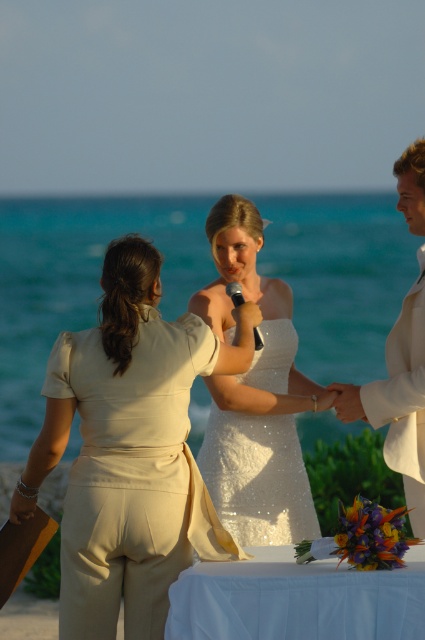
Question: Which object is closer to the camera taking this photo?

Choices:
 (A) white sequined dress at center
 (B) beige satin jumpsuit at center
 (C) white cloth table at center

Answer: (C)

Question: Can you confirm if beige satin jumpsuit at center is positioned below white satin suit at right?

Choices:
 (A) yes
 (B) no

Answer: (A)

Question: Is beige satin jumpsuit at center bigger than white cloth table at center?

Choices:
 (A) no
 (B) yes

Answer: (B)

Question: Among these objects, which one is farthest from the camera?

Choices:
 (A) white cloth table at center
 (B) beige satin jumpsuit at center

Answer: (B)

Question: Which point appears farthest from the camera in this image?

Choices:
 (A) tap(129, 369)
 (B) tap(397, 401)
 (C) tap(317, 400)
 (D) tap(181, 602)

Answer: (C)

Question: Is white sequined dress at center to the left of white satin suit at right from the viewer's perspective?

Choices:
 (A) yes
 (B) no

Answer: (A)